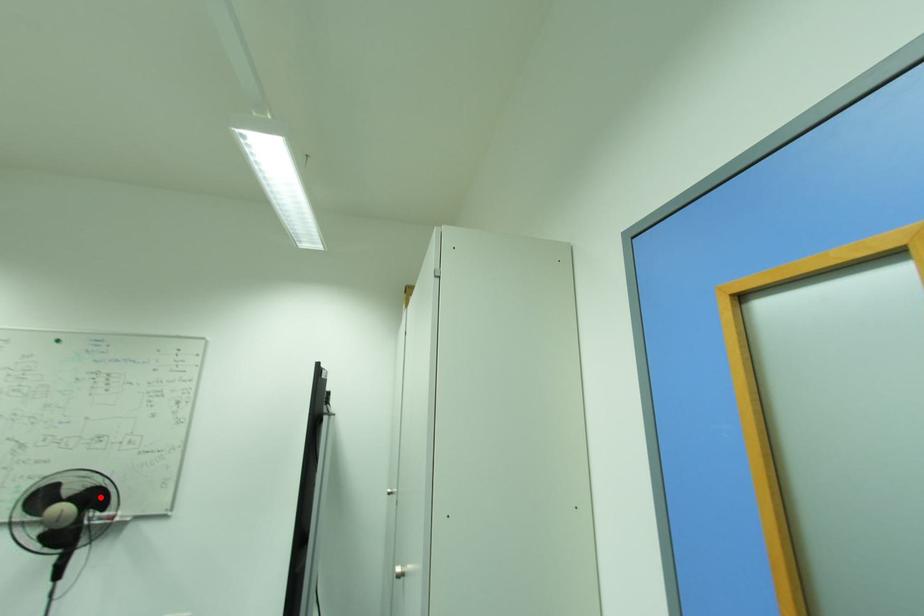
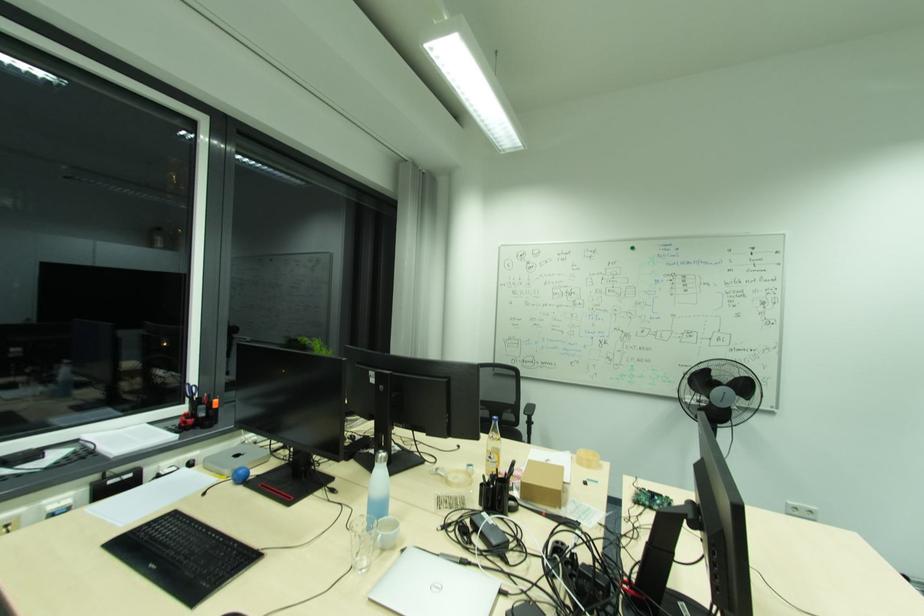
In the second image, find the point that corresponds to the highlighted location in the first image.

(748, 387)